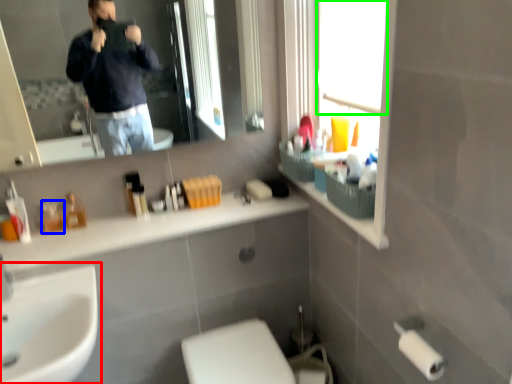
Question: Estimate the real-world distances between objects in this image. Which object is farther from sink (highlighted by a red box), toiletry (highlighted by a blue box) or window screen (highlighted by a green box)?

Choices:
 (A) toiletry
 (B) window screen

Answer: (B)